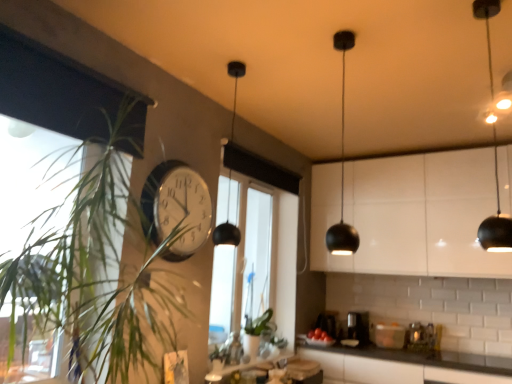
Question: Does black matte pendant light at upper right have a smaller size compared to black matte pendant light at upper center?

Choices:
 (A) yes
 (B) no

Answer: (B)

Question: From a real-world perspective, is black matte pendant light at upper right positioned over black matte pendant light at upper center based on gravity?

Choices:
 (A) yes
 (B) no

Answer: (A)

Question: Can you confirm if black matte pendant light at upper right is wider than black matte pendant light at upper center?

Choices:
 (A) no
 (B) yes

Answer: (B)

Question: Is black matte pendant light at upper right at the left side of black matte pendant light at upper center?

Choices:
 (A) yes
 (B) no

Answer: (B)

Question: Considering the relative positions of black matte pendant light at upper right and black matte pendant light at upper center in the image provided, is black matte pendant light at upper right in front of black matte pendant light at upper center?

Choices:
 (A) yes
 (B) no

Answer: (A)

Question: From their relative heights in the image, would you say white glossy clock at center is taller or shorter than green leafy plant at left?

Choices:
 (A) short
 (B) tall

Answer: (A)

Question: Is white glossy clock at center in front of or behind green leafy plant at left in the image?

Choices:
 (A) behind
 (B) front

Answer: (A)

Question: Based on their positions, is white glossy clock at center located to the left or right of green leafy plant at left?

Choices:
 (A) left
 (B) right

Answer: (B)

Question: From the image's perspective, is white glossy clock at center positioned above or below green leafy plant at left?

Choices:
 (A) below
 (B) above

Answer: (B)

Question: Based on their sizes in the image, would you say black matte pendant light at upper right is bigger or smaller than white glossy clock at center?

Choices:
 (A) big
 (B) small

Answer: (A)

Question: Is black matte pendant light at upper right inside the boundaries of white glossy clock at center, or outside?

Choices:
 (A) inside
 (B) outside

Answer: (B)

Question: Would you say black matte pendant light at upper right is to the left or to the right of white glossy clock at center in the picture?

Choices:
 (A) right
 (B) left

Answer: (A)

Question: From the image's perspective, is black matte pendant light at upper right positioned above or below white glossy clock at center?

Choices:
 (A) above
 (B) below

Answer: (A)

Question: Would you say black matte pendant light at center is to the left or to the right of transparent glass window at center in the picture?

Choices:
 (A) left
 (B) right

Answer: (A)

Question: From their relative heights in the image, would you say black matte pendant light at center is taller or shorter than transparent glass window at center?

Choices:
 (A) tall
 (B) short

Answer: (B)